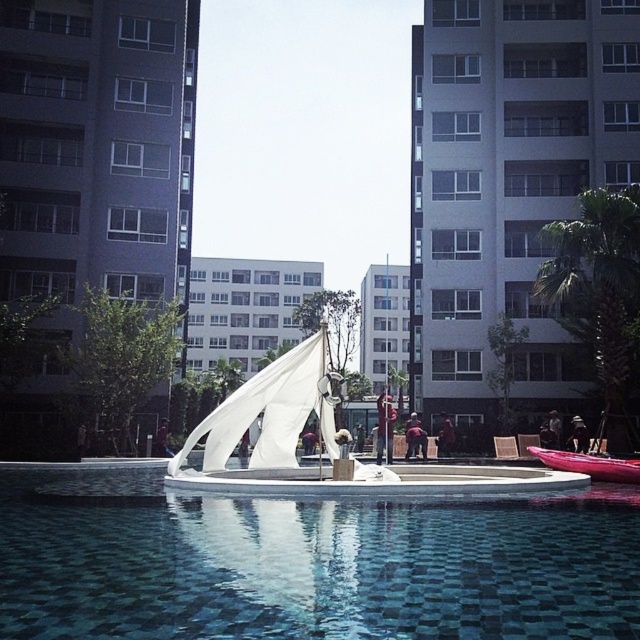
Question: Can you confirm if white fabric canopy at center is wider than shiny red canoe at lower right?

Choices:
 (A) yes
 (B) no

Answer: (A)

Question: Which object appears closest to the camera in this image?

Choices:
 (A) blue glossy water at center
 (B) white fabric canopy at center
 (C) shiny red canoe at lower right

Answer: (A)

Question: Which object is the closest to the shiny red canoe at lower right?

Choices:
 (A) white fabric canopy at center
 (B) blue glossy water at center

Answer: (A)

Question: Does blue glossy water at center appear on the right side of white fabric canopy at center?

Choices:
 (A) no
 (B) yes

Answer: (B)

Question: Can you confirm if blue glossy water at center is positioned above shiny red canoe at lower right?

Choices:
 (A) no
 (B) yes

Answer: (B)

Question: Which object appears farthest from the camera in this image?

Choices:
 (A) blue glossy water at center
 (B) white fabric canopy at center
 (C) shiny red canoe at lower right

Answer: (C)